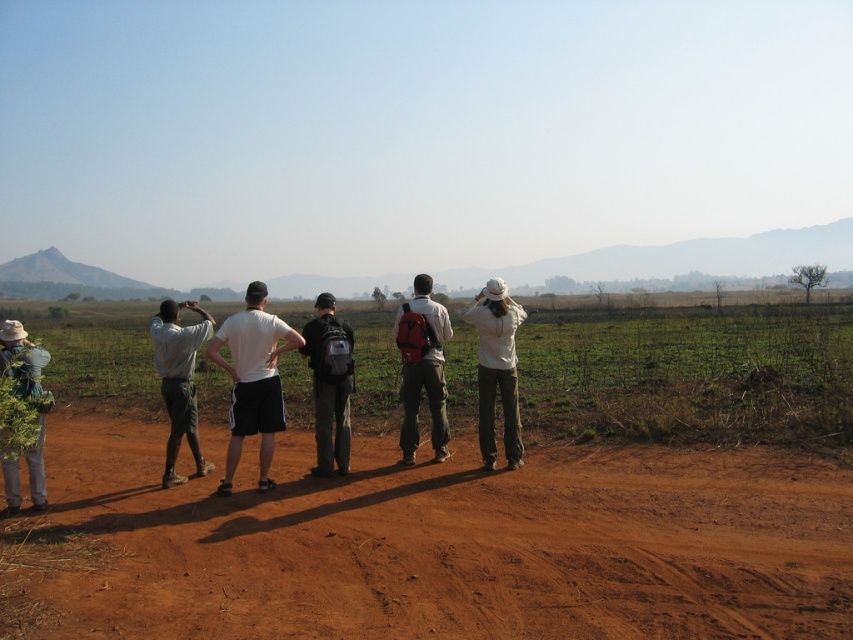
Question: Which of the following is the farthest from the observer?

Choices:
 (A) dirt at center
 (B) white matte hat at center
 (C) matte white shirt at left
 (D) green leafy plant at left

Answer: (B)

Question: Which point is farther to the camera?

Choices:
 (A) white matte shorts at center
 (B) white matte hat at center

Answer: (B)

Question: Where is dirt at center located in relation to matte gray backpack at center in the image?

Choices:
 (A) above
 (B) below

Answer: (B)

Question: Can you confirm if white matte shorts at center is wider than white matte hat at center?

Choices:
 (A) yes
 (B) no

Answer: (A)

Question: Can you confirm if dirt at center is positioned to the left of matte red backpack at center?

Choices:
 (A) no
 (B) yes

Answer: (A)

Question: Which point is closer to the camera taking this photo?

Choices:
 (A) (224, 364)
 (B) (317, 440)

Answer: (A)